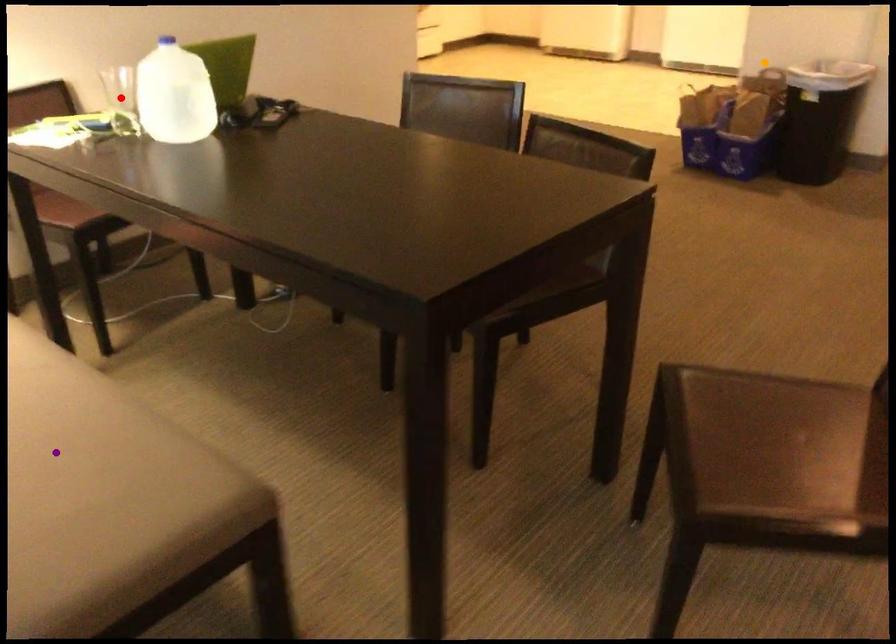
Order these from farthest to nearest:
purple point
orange point
red point

orange point → red point → purple point